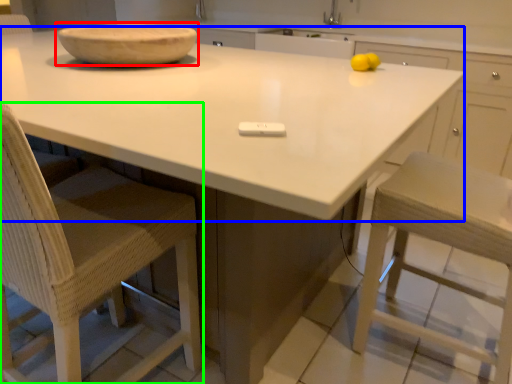
Question: Which object is the closest to the bowl (highlighted by a red box)? Choose among these: countertop (highlighted by a blue box) or chair (highlighted by a green box).

Choices:
 (A) countertop
 (B) chair

Answer: (A)